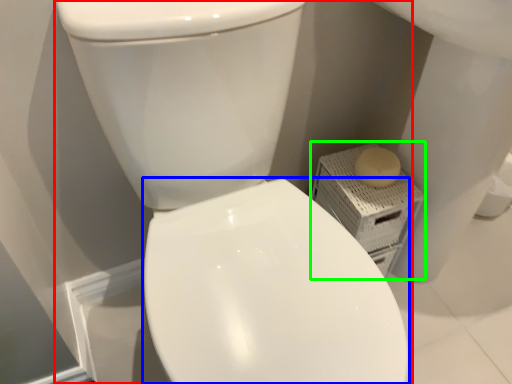
Question: Which object is the closest to the toilet (highlighted by a red box)? Choose among these: bidet (highlighted by a blue box) or porcelain (highlighted by a green box).

Choices:
 (A) bidet
 (B) porcelain

Answer: (A)